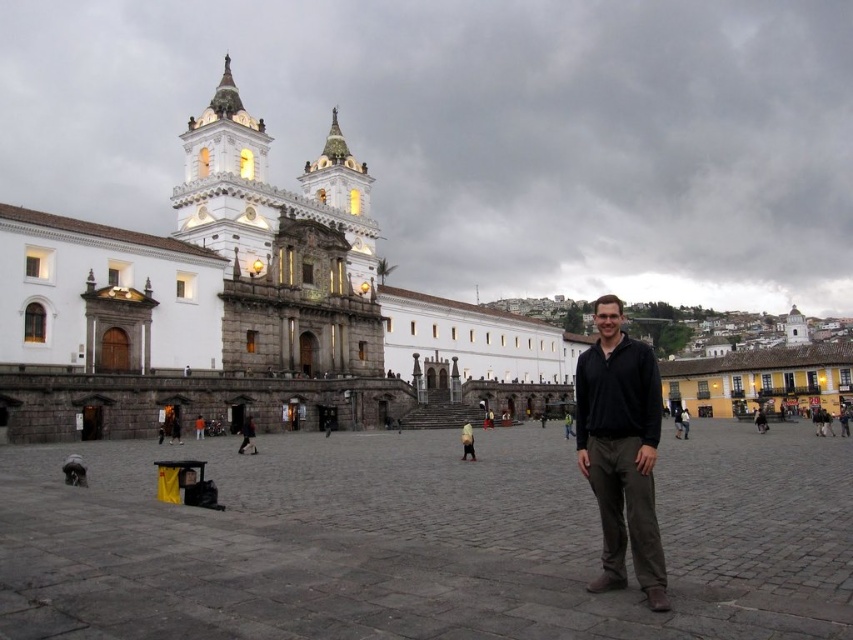
You are a photographer planning to take a picture of the white stone church at center and the black matte shirt at center from the same angle. Which object will appear larger in the photo?

The white stone church at center will appear larger in the photo because it is much taller than the black matte shirt at center.

You are a photographer trying to capture the entire white stone church at center and the black matte shirt at center in a single frame. Given that the camera can only focus on objects within a 100cm width, will both objects fit in the frame?

The white stone church at center is bigger than the black matte shirt at center. However, the camera can only focus on objects within a 100cm width. Since the church is larger, it may exceed the frame width, making it impossible to capture both fully.

You are standing in the plaza facing the historic building. You see a person in a black matte shirt at center and another in a dark brown leather jacket at center. Which person is standing closer to you?

The black matte shirt at center is closer to the viewer than the dark brown leather jacket at center.